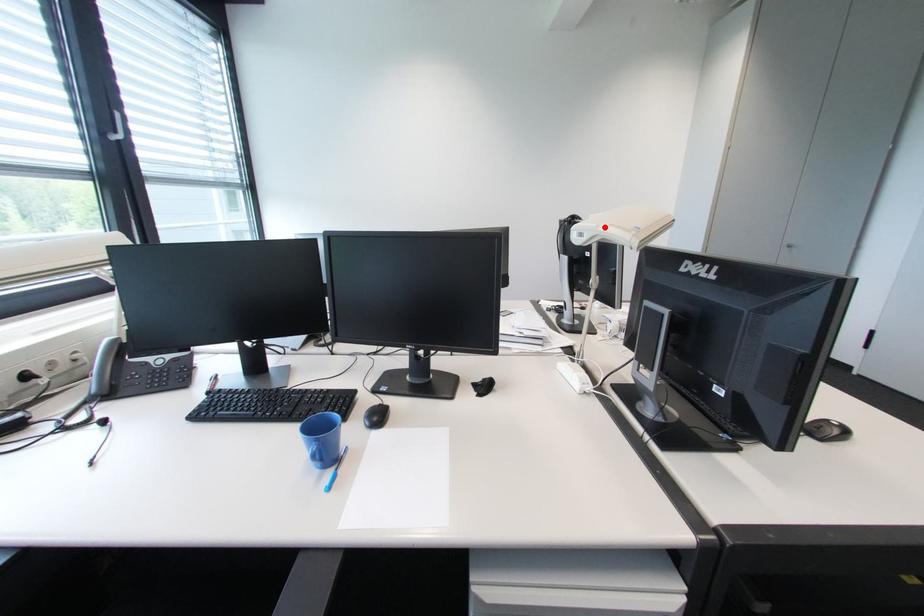
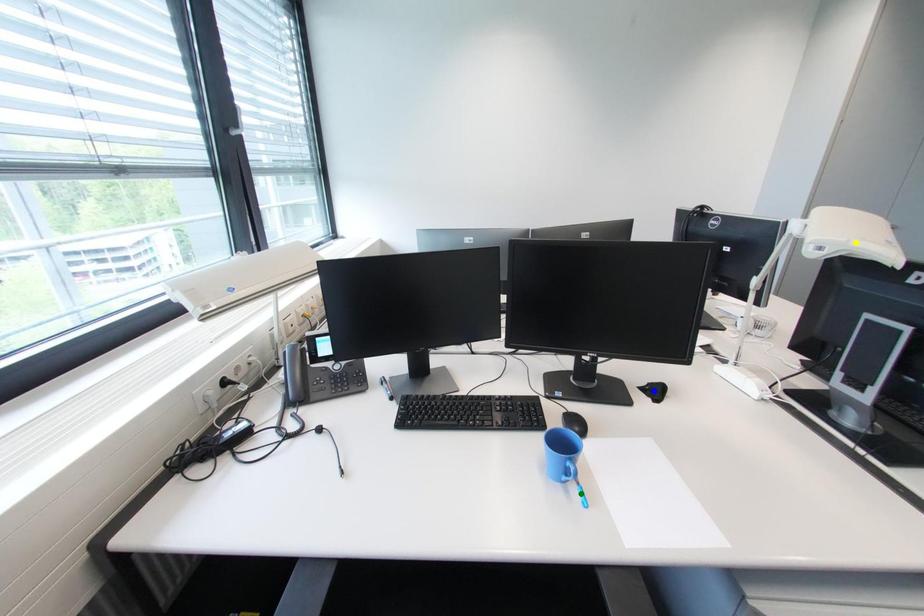
Question: I am providing you with two images of the same scene from different viewpoints. A red point is marked on the first image. You are given multiple points on the second image. Which point in image 2 is actually the same real-world point as the red point in image 1?

Choices:
 (A) yellow point
 (B) blue point
 (C) green point

Answer: (A)